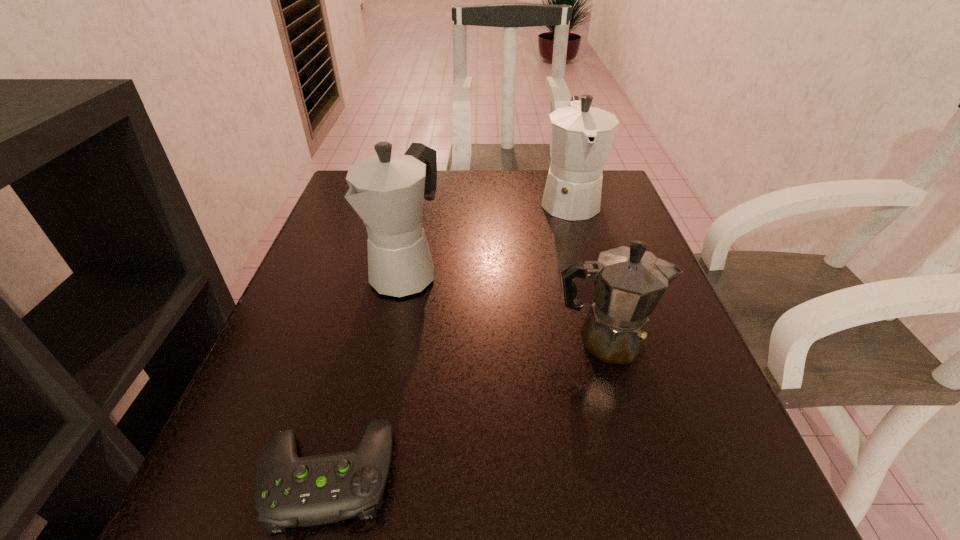
You are a GUI agent. You are given a task and a screenshot of the screen. Output one action in this format:
    pyautogui.click(x=<x>, y=<y>)
    Task: Click on the second nearest coffeepot
    This screenshot has width=960, height=540.
    Given the screenshot: What is the action you would take?
    pyautogui.click(x=387, y=190)

The height and width of the screenshot is (540, 960). Find the location of `the leftmost coffeepot`. the leftmost coffeepot is located at coordinates (387, 190).

At what (x,y) coordinates should I click in order to perform the action: click on the farthest object. Please return your answer as a coordinate pair (x, y). This screenshot has height=540, width=960. Looking at the image, I should click on (581, 136).

This screenshot has height=540, width=960. I want to click on the second nearest object, so click(x=628, y=281).

At what (x,y) coordinates should I click in order to perform the action: click on the third tallest object. Please return your answer as a coordinate pair (x, y). Image resolution: width=960 pixels, height=540 pixels. Looking at the image, I should click on (628, 281).

You are a GUI agent. You are given a task and a screenshot of the screen. Output one action in this format:
    pyautogui.click(x=<x>, y=<y>)
    Task: Click on the nearest object
    The image size is (960, 540).
    Given the screenshot: What is the action you would take?
    pyautogui.click(x=289, y=491)

In order to click on control in this screenshot , I will do click(289, 491).

The width and height of the screenshot is (960, 540). I want to click on free space located on the right of the second farthest coffeepot, so click(597, 273).

Where is `blank space located 0.180m at the spout of the farthest object`? The width and height of the screenshot is (960, 540). blank space located 0.180m at the spout of the farthest object is located at coordinates click(x=592, y=278).

You are a GUI agent. You are given a task and a screenshot of the screen. Output one action in this format:
    pyautogui.click(x=<x>, y=<y>)
    Task: Click on the vacant space situated 0.070m on the back of the shortest object
    The width and height of the screenshot is (960, 540).
    Given the screenshot: What is the action you would take?
    pyautogui.click(x=351, y=385)